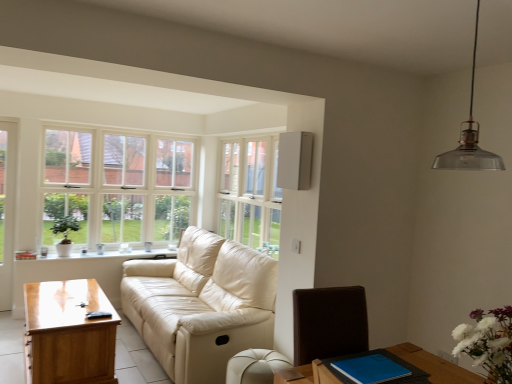
Question: Considering the relative sizes of beige leather couch at center and white ceramic window sill at lower left in the image provided, is beige leather couch at center thinner than white ceramic window sill at lower left?

Choices:
 (A) no
 (B) yes

Answer: (A)

Question: Does beige leather couch at center have a larger size compared to white ceramic window sill at lower left?

Choices:
 (A) yes
 (B) no

Answer: (A)

Question: Is beige leather couch at center not near white ceramic window sill at lower left?

Choices:
 (A) no
 (B) yes

Answer: (B)

Question: From the image's perspective, is beige leather couch at center on white ceramic window sill at lower left?

Choices:
 (A) yes
 (B) no

Answer: (B)

Question: Considering the relative sizes of beige leather couch at center and white ceramic window sill at lower left in the image provided, is beige leather couch at center shorter than white ceramic window sill at lower left?

Choices:
 (A) yes
 (B) no

Answer: (B)

Question: Is beige leather couch at center smaller than white ceramic window sill at lower left?

Choices:
 (A) yes
 (B) no

Answer: (B)

Question: Considering the relative sizes of white leather ottoman at lower center and white matte flowers at lower right in the image provided, is white leather ottoman at lower center wider than white matte flowers at lower right?

Choices:
 (A) yes
 (B) no

Answer: (A)

Question: Is white leather ottoman at lower center located outside white matte flowers at lower right?

Choices:
 (A) yes
 (B) no

Answer: (A)

Question: Is white matte flowers at lower right at the back of white leather ottoman at lower center?

Choices:
 (A) no
 (B) yes

Answer: (A)

Question: From the image's perspective, is white leather ottoman at lower center beneath white matte flowers at lower right?

Choices:
 (A) no
 (B) yes

Answer: (B)

Question: Considering the relative sizes of white leather ottoman at lower center and white matte flowers at lower right in the image provided, is white leather ottoman at lower center thinner than white matte flowers at lower right?

Choices:
 (A) no
 (B) yes

Answer: (A)

Question: Is white leather ottoman at lower center to the right of white matte flowers at lower right from the viewer's perspective?

Choices:
 (A) no
 (B) yes

Answer: (A)

Question: Does white wooden window at upper left, the 2th window positioned from the right, touch white matte flowers at lower right?

Choices:
 (A) no
 (B) yes

Answer: (A)